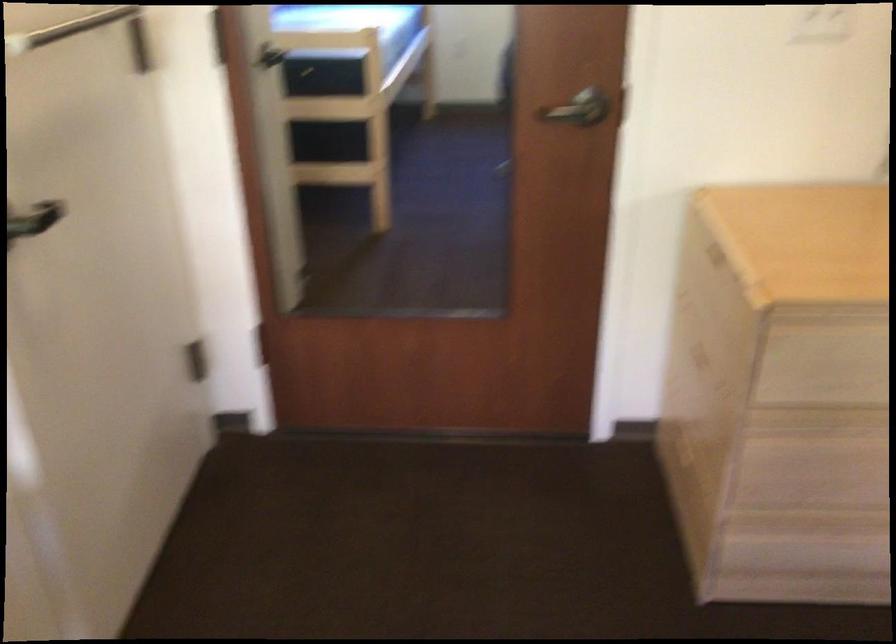
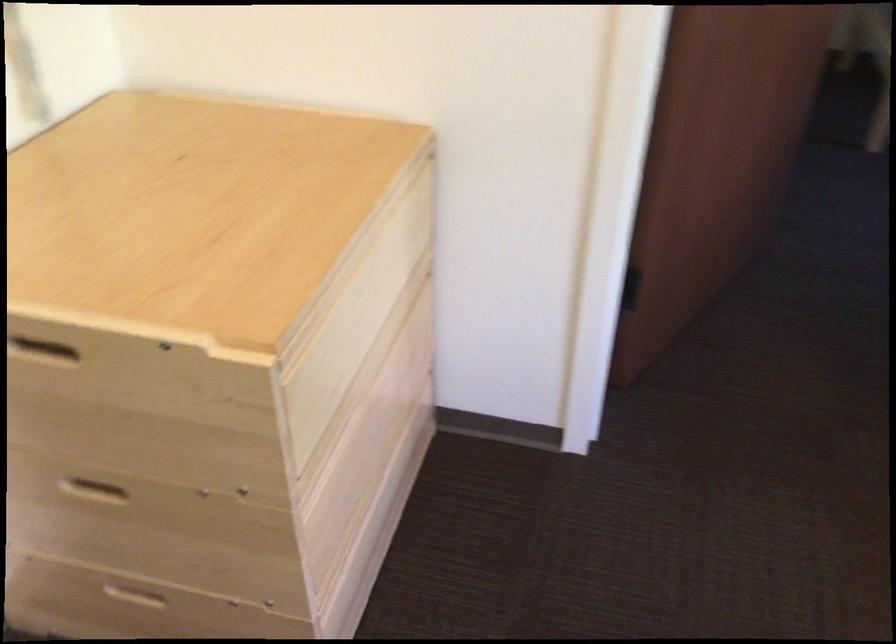
From the picture: How did the camera likely rotate?

The rotation direction of the camera is right-down.